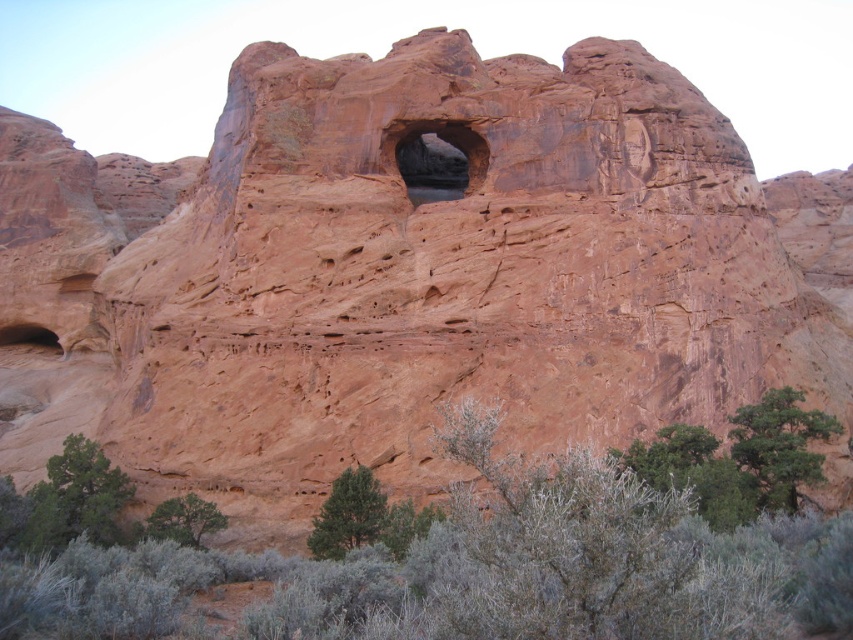
Can you confirm if green leafy tree at lower left is taller than green leafy shrub at lower left?

Indeed, green leafy tree at lower left has a greater height compared to green leafy shrub at lower left.

Can you confirm if green leafy tree at lower left is wider than green leafy shrub at lower left?

Correct, the width of green leafy tree at lower left exceeds that of green leafy shrub at lower left.

Between point (97, 486) and point (194, 499), which one is positioned in front?

Positioned in front is point (194, 499).

Where is `green leafy tree at lower left`? This screenshot has width=853, height=640. green leafy tree at lower left is located at coordinates (71, 500).

Which of these two, green leafy shrubs at lower center or green leafy shrub at lower left, stands shorter?

Standing shorter between the two is green leafy shrub at lower left.

Does green leafy shrubs at lower center appear on the left side of green leafy shrub at lower left?

Incorrect, green leafy shrubs at lower center is not on the left side of green leafy shrub at lower left.

Locate an element on the screen. This screenshot has height=640, width=853. green leafy shrubs at lower center is located at coordinates (463, 556).

Is green leafy tree at lower left above green leafy tree at lower right?

Actually, green leafy tree at lower left is below green leafy tree at lower right.

Is green leafy tree at lower left thinner than green leafy tree at lower right?

Indeed, green leafy tree at lower left has a lesser width compared to green leafy tree at lower right.

You are a GUI agent. You are given a task and a screenshot of the screen. Output one action in this format:
    pyautogui.click(x=<x>, y=<y>)
    Task: Click on the green leafy tree at lower left
    
    Given the screenshot: What is the action you would take?
    pyautogui.click(x=71, y=500)

In order to click on green leafy tree at lower left in this screenshot , I will do `click(71, 500)`.